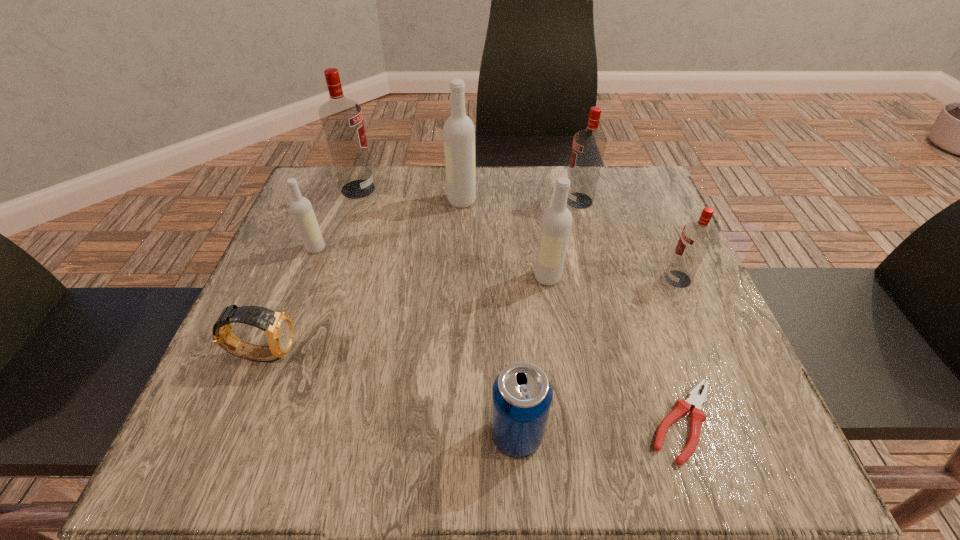
Where is `free space between the biggest red vodka and the sixth object from right to left`? This screenshot has height=540, width=960. free space between the biggest red vodka and the sixth object from right to left is located at coordinates (410, 195).

Image resolution: width=960 pixels, height=540 pixels. I want to click on free spot between the third vodka from left to right and the seventh tallest object, so click(490, 318).

Locate which object ranks in proximity to the eighth tallest object. Please provide its 2D coordinates. Your answer should be formatted as a tuple, i.e. [(x, y)], where the tuple contains the x and y coordinates of a point satisfying the conditions above.

[(301, 208)]

Select which object is the third closest to the fourth farthest vodka. Please provide its 2D coordinates. Your answer should be formatted as a tuple, i.e. [(x, y)], where the tuple contains the x and y coordinates of a point satisfying the conditions above.

[(459, 132)]

Select which vodka appears as the closest to the second shortest object. Please provide its 2D coordinates. Your answer should be formatted as a tuple, i.e. [(x, y)], where the tuple contains the x and y coordinates of a point satisfying the conditions above.

[(301, 208)]

Where is `the second closest vodka relative to the biggest white vodka`? This screenshot has height=540, width=960. the second closest vodka relative to the biggest white vodka is located at coordinates pos(589,145).

Locate which white vodka ranks second in proximity to the watch. Please provide its 2D coordinates. Your answer should be formatted as a tuple, i.e. [(x, y)], where the tuple contains the x and y coordinates of a point satisfying the conditions above.

[(459, 132)]

Where is `white vodka that is the third closest to the gold watch`? This screenshot has width=960, height=540. white vodka that is the third closest to the gold watch is located at coordinates 556,223.

Identify which red vodka is the third closest to the fourth object from left to right. Please provide its 2D coordinates. Your answer should be formatted as a tuple, i.e. [(x, y)], where the tuple contains the x and y coordinates of a point satisfying the conditions above.

[(696, 237)]

Identify which red vodka is the third nearest to the leftmost white vodka. Please provide its 2D coordinates. Your answer should be formatted as a tuple, i.e. [(x, y)], where the tuple contains the x and y coordinates of a point satisfying the conditions above.

[(696, 237)]